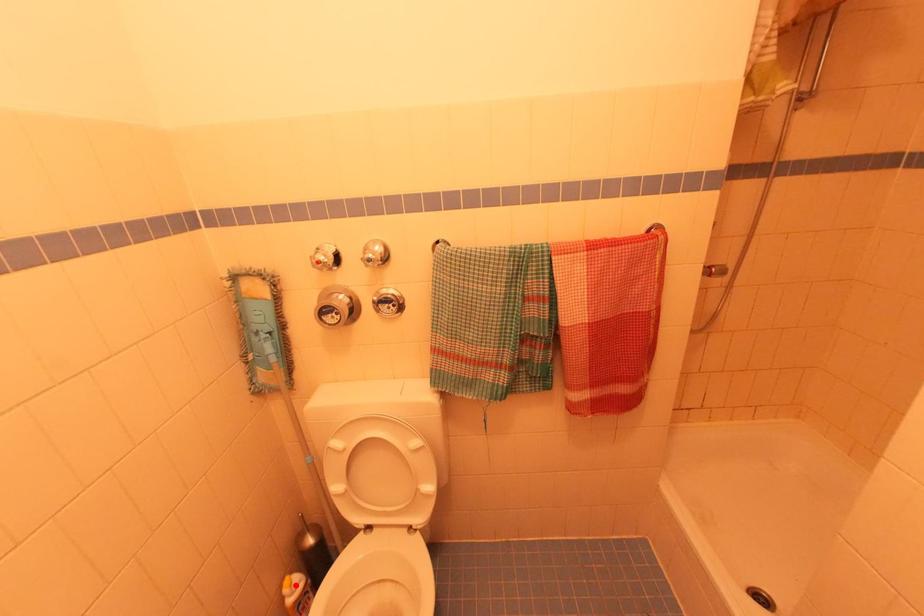
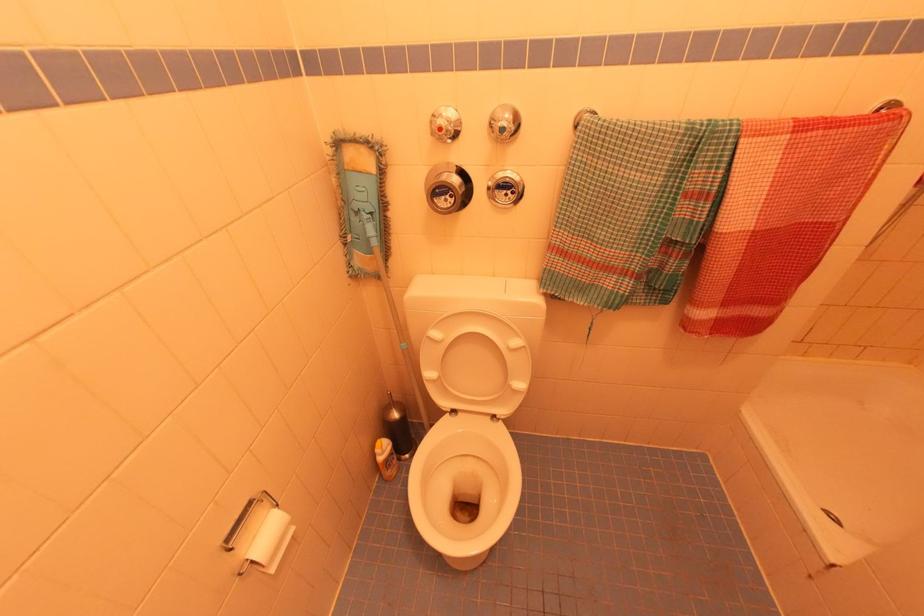
Where in the second image is the point corresponding to the highlighted location from the first image?

(385, 448)